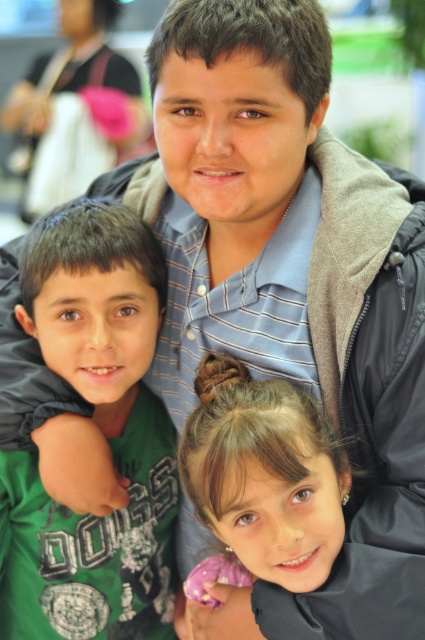
Is point (51, 333) positioned after point (240, 545)?

Yes, point (51, 333) is farther from viewer.

From the picture: Can you confirm if green cotton shirt at center is thinner than smooth brown hair at lower center?

Correct, green cotton shirt at center's width is less than smooth brown hair at lower center's.

You are a GUI agent. You are given a task and a screenshot of the screen. Output one action in this format:
    pyautogui.click(x=<x>, y=<y>)
    Task: Click on the green cotton shirt at center
    This screenshot has height=640, width=425.
    Given the screenshot: What is the action you would take?
    pyautogui.click(x=99, y=428)